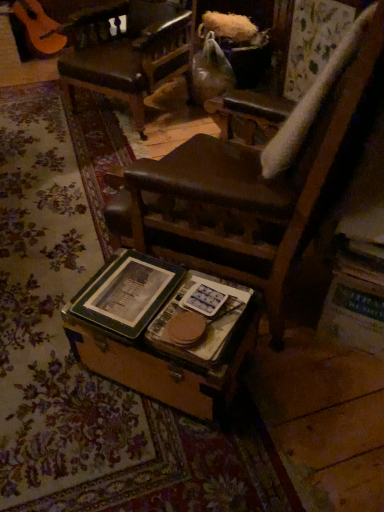
Question: From a real-world perspective, is wooden trunk at center below hardcover book at center, marked as the 2th paperback book in a left-to-right arrangement?

Choices:
 (A) no
 (B) yes

Answer: (B)

Question: Is the surface of wooden trunk at center in direct contact with hardcover book at center, the first paperback book viewed from the right?

Choices:
 (A) yes
 (B) no

Answer: (A)

Question: Can you confirm if wooden trunk at center is smaller than hardcover book at center, the first paperback book viewed from the right?

Choices:
 (A) yes
 (B) no

Answer: (B)

Question: Considering the relative positions of wooden trunk at center and hardcover book at center, marked as the 2th paperback book in a left-to-right arrangement, in the image provided, is wooden trunk at center to the right of hardcover book at center, marked as the 2th paperback book in a left-to-right arrangement, from the viewer's perspective?

Choices:
 (A) yes
 (B) no

Answer: (B)

Question: Can you confirm if wooden trunk at center is positioned to the left of hardcover book at center, marked as the 2th paperback book in a left-to-right arrangement?

Choices:
 (A) yes
 (B) no

Answer: (A)

Question: Is wooden trunk at center not inside hardcover book at center, the first paperback book viewed from the right?

Choices:
 (A) yes
 (B) no

Answer: (A)

Question: Is hardcover book at center, marked as the 2th paperback book in a left-to-right arrangement, turned away from leather seat at center?

Choices:
 (A) no
 (B) yes

Answer: (A)

Question: Is hardcover book at center, the first paperback book viewed from the right, in contact with leather seat at center?

Choices:
 (A) no
 (B) yes

Answer: (A)

Question: Is hardcover book at center, the first paperback book viewed from the right, outside leather seat at center?

Choices:
 (A) yes
 (B) no

Answer: (A)

Question: Considering the relative positions of hardcover book at center, the first paperback book viewed from the right, and leather seat at center in the image provided, is hardcover book at center, the first paperback book viewed from the right, to the right of leather seat at center from the viewer's perspective?

Choices:
 (A) no
 (B) yes

Answer: (B)

Question: Does hardcover book at center, marked as the 2th paperback book in a left-to-right arrangement, have a greater width compared to leather seat at center?

Choices:
 (A) yes
 (B) no

Answer: (B)

Question: Is the position of hardcover book at center, marked as the 2th paperback book in a left-to-right arrangement, more distant than that of leather seat at center?

Choices:
 (A) yes
 (B) no

Answer: (B)

Question: Could you tell me if wooden trunk at center is facing green matte book at center, arranged as the 2th paperback book when viewed from the right?

Choices:
 (A) yes
 (B) no

Answer: (B)